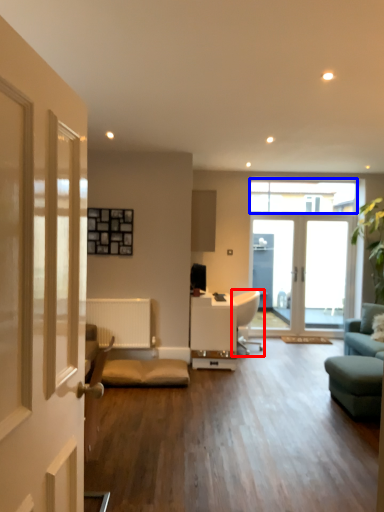
Question: Which of the following is the farthest to the observer, chair (highlighted by a red box) or window (highlighted by a blue box)?

Choices:
 (A) chair
 (B) window

Answer: (B)